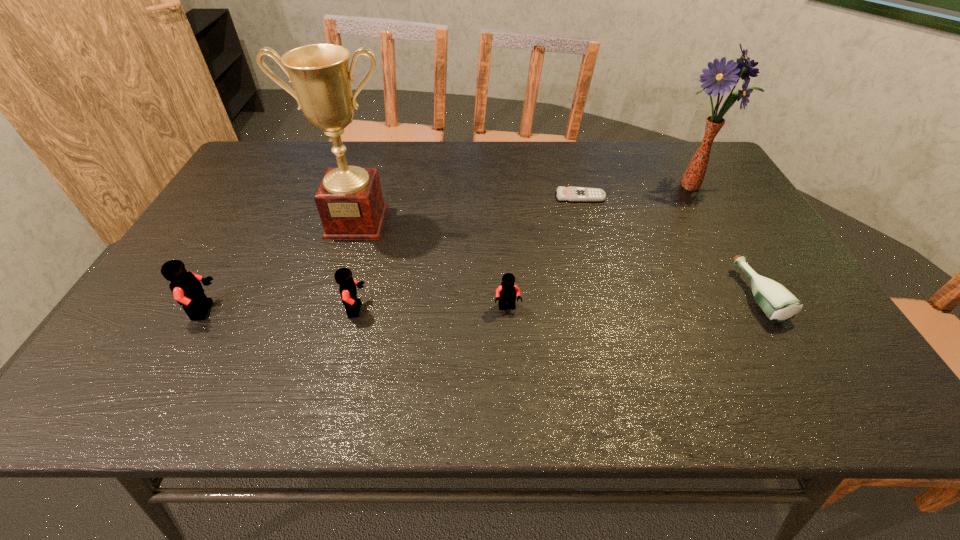
Locate an element on the screen. The width and height of the screenshot is (960, 540). the sixth tallest object is located at coordinates (779, 304).

This screenshot has height=540, width=960. Find the location of `free space located on the front-facing side of the leftmost Lego`. free space located on the front-facing side of the leftmost Lego is located at coordinates (333, 310).

Where is `free location located 0.270m on the front-facing side of the fourth shortest object`? The height and width of the screenshot is (540, 960). free location located 0.270m on the front-facing side of the fourth shortest object is located at coordinates (487, 309).

At what (x,y) coordinates should I click in order to perform the action: click on vacant space located 0.220m on the right of the remote control. Please return your answer as a coordinate pair (x, y). Image resolution: width=960 pixels, height=540 pixels. Looking at the image, I should click on [x=680, y=197].

The height and width of the screenshot is (540, 960). I want to click on vacant region located 0.130m on the left of the flower arrangement, so click(617, 185).

The width and height of the screenshot is (960, 540). What are the coordinates of `free space located 0.250m on the plaque of the fifth nearest object` in the screenshot? It's located at (328, 313).

Locate an element on the screen. This screenshot has height=540, width=960. blank space located on the left of the second shortest object is located at coordinates (716, 295).

The width and height of the screenshot is (960, 540). Identify the location of object at the far edge. (717, 79).

Identify the location of Lego situated at the near edge. tap(186, 287).

This screenshot has width=960, height=540. I want to click on bottle located in the near edge section of the desktop, so click(x=779, y=304).